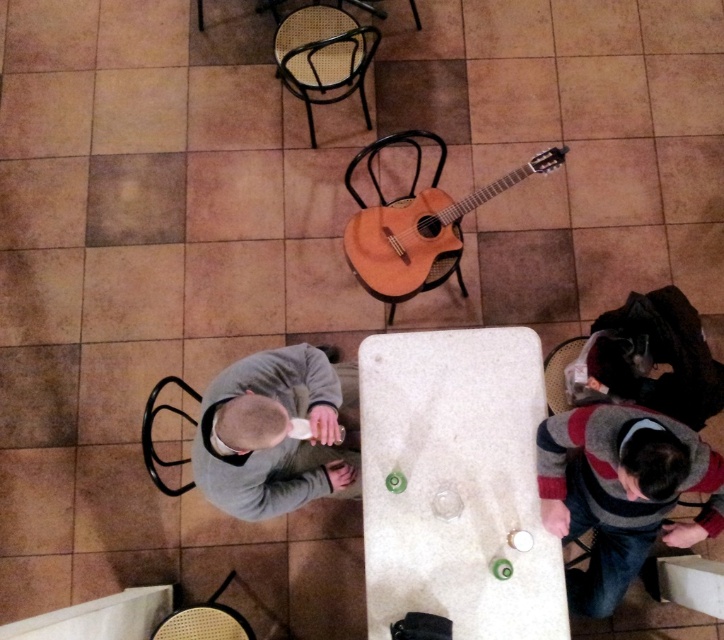
This screenshot has height=640, width=724. What do you see at coordinates (455, 484) in the screenshot?
I see `white marble table at center` at bounding box center [455, 484].

Who is higher up, white marble table at center or woven straw chair at lower right?

woven straw chair at lower right is above.

Does point (374, 476) come in front of point (555, 390)?

Yes, it is.

Find the location of a particular element. white marble table at center is located at coordinates click(x=455, y=484).

In the scene shown: Who is shorter, striped sweater at lower right or rattan chair at lower left?

rattan chair at lower left is shorter.

How much distance is there between striped sweater at lower right and rattan chair at lower left?

1.20 meters

Between point (597, 410) and point (172, 620), which one is positioned behind?

The point (172, 620) is more distant.

The image size is (724, 640). Identify the location of striped sweater at lower right. (620, 492).

Is rattan chair at lower left below woven straw chair at lower right?

Correct, rattan chair at lower left is located below woven straw chair at lower right.

Between point (206, 612) and point (559, 403), which one is positioned in front?

Point (206, 612) is in front.

Where is `rattan chair at lower left`? rattan chair at lower left is located at coordinates (203, 624).